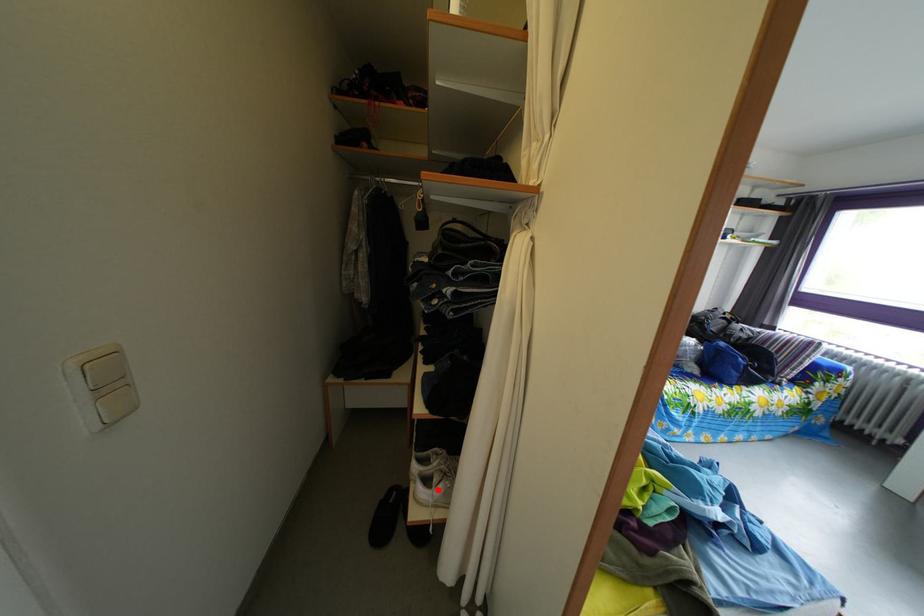
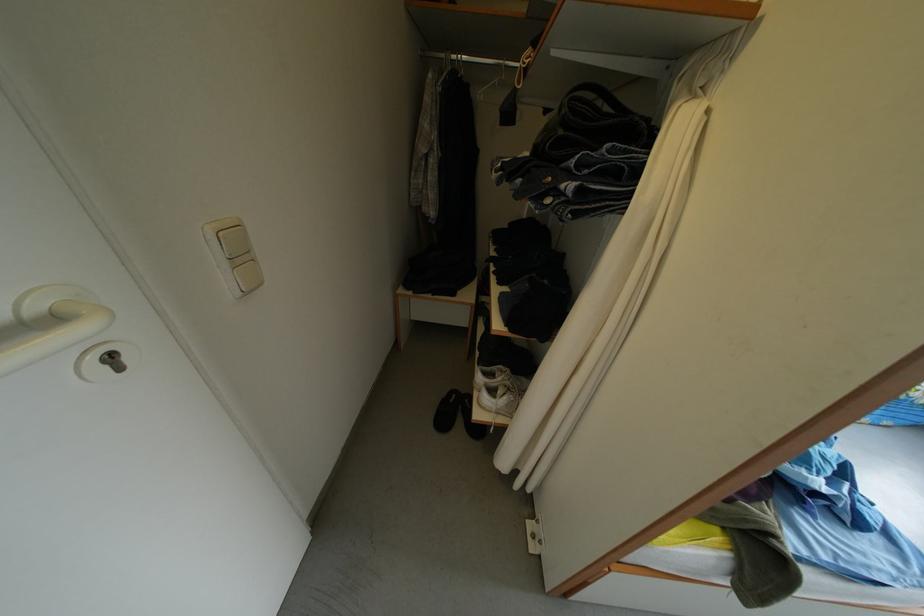
Where in the second image is the point corresponding to the highlighted location from the first image?

(503, 400)